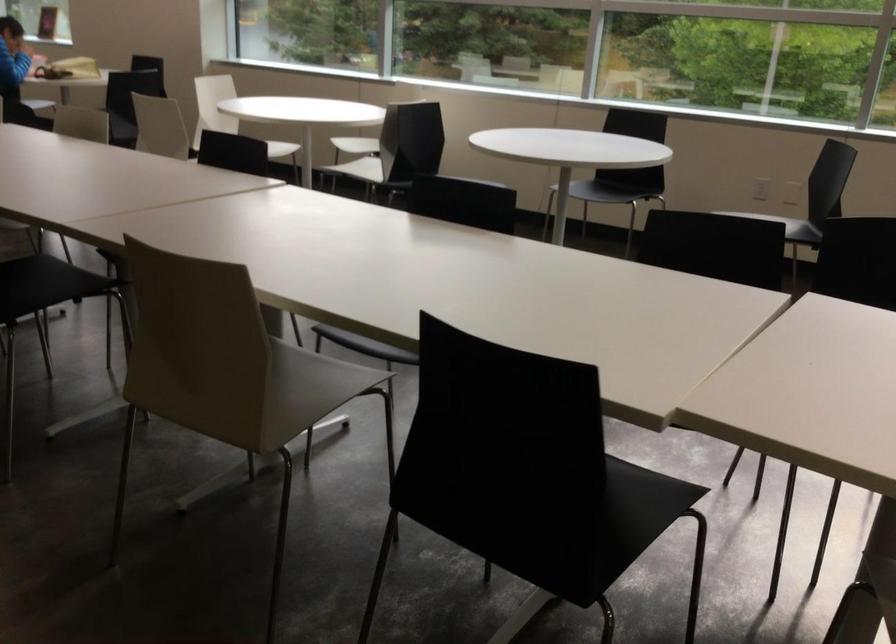
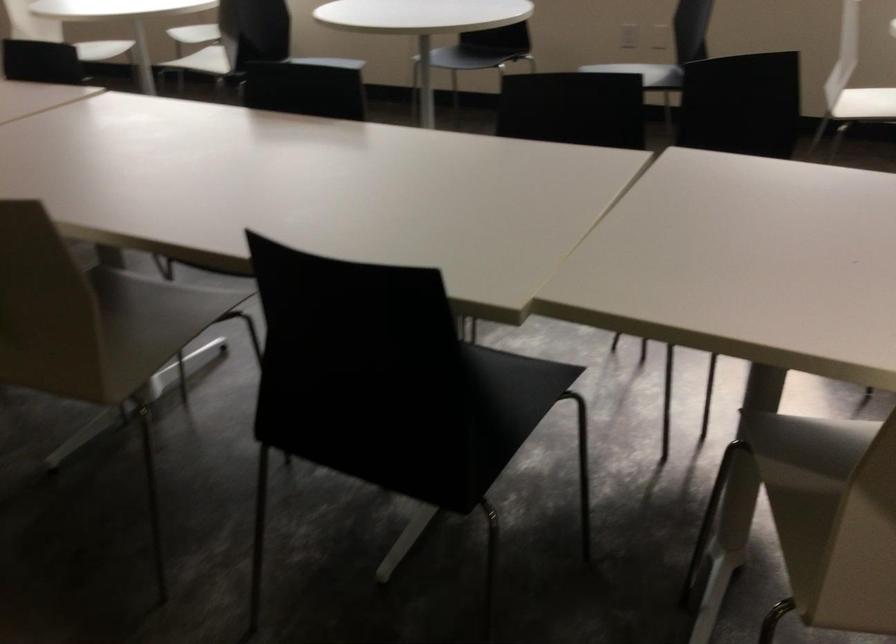
Locate, in the second image, the point that corresponds to the point at 308,384 in the first image.

(159, 317)